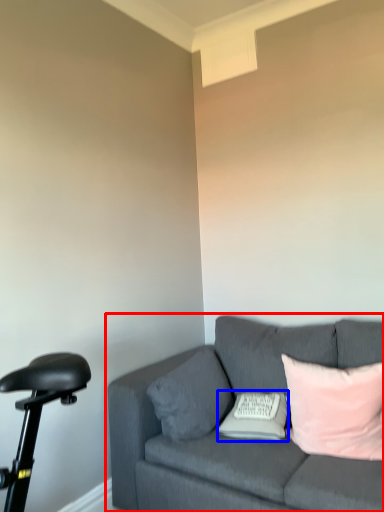
Question: Which object appears farthest to the camera in this image, studio couch (highlighted by a red box) or pillow (highlighted by a blue box)?

Choices:
 (A) studio couch
 (B) pillow

Answer: (B)